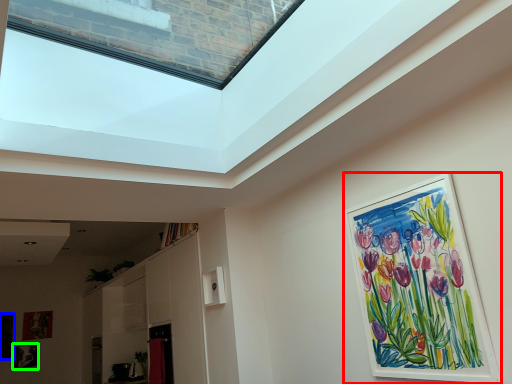
Question: Estimate the real-world distances between objects in this image. Which object is farther from picture frame (highlighted by a red box), picture frame (highlighted by a blue box) or picture frame (highlighted by a green box)?

Choices:
 (A) picture frame
 (B) picture frame

Answer: (A)